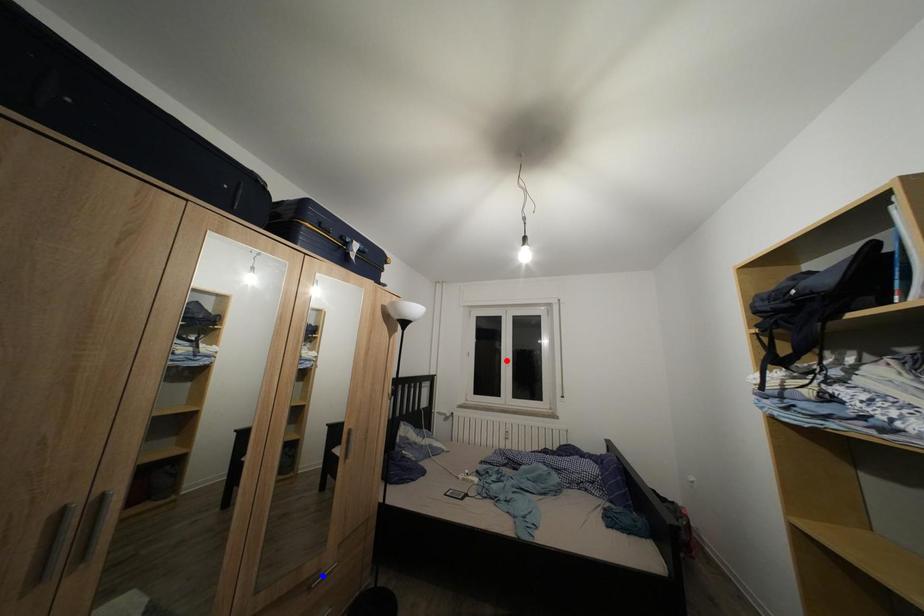
Question: Two points are marked on the image. Which point is closer to the camera?

Choices:
 (A) Blue point is closer.
 (B) Red point is closer.

Answer: (A)